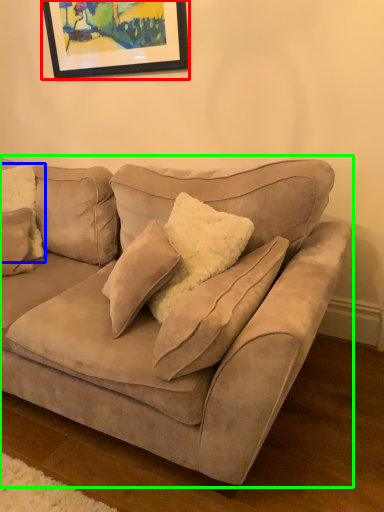
Question: Which object is the farthest from picture frame (highlighted by a red box)? Choose among these: pillow (highlighted by a blue box) or studio couch (highlighted by a green box).

Choices:
 (A) pillow
 (B) studio couch

Answer: (B)